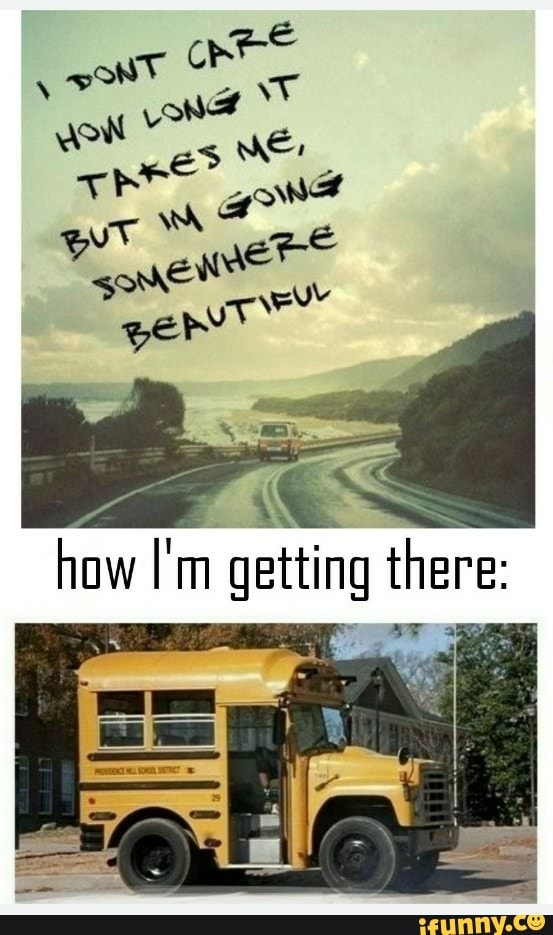
The height and width of the screenshot is (935, 553). I want to click on window, so click(x=138, y=713), click(x=184, y=726).